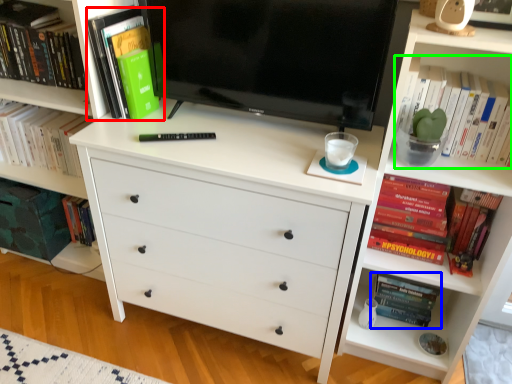
Question: Which object is positioned farthest from book (highlighted by a red box)? Select from book (highlighted by a blue box) and book (highlighted by a green box).

Choices:
 (A) book
 (B) book

Answer: (A)